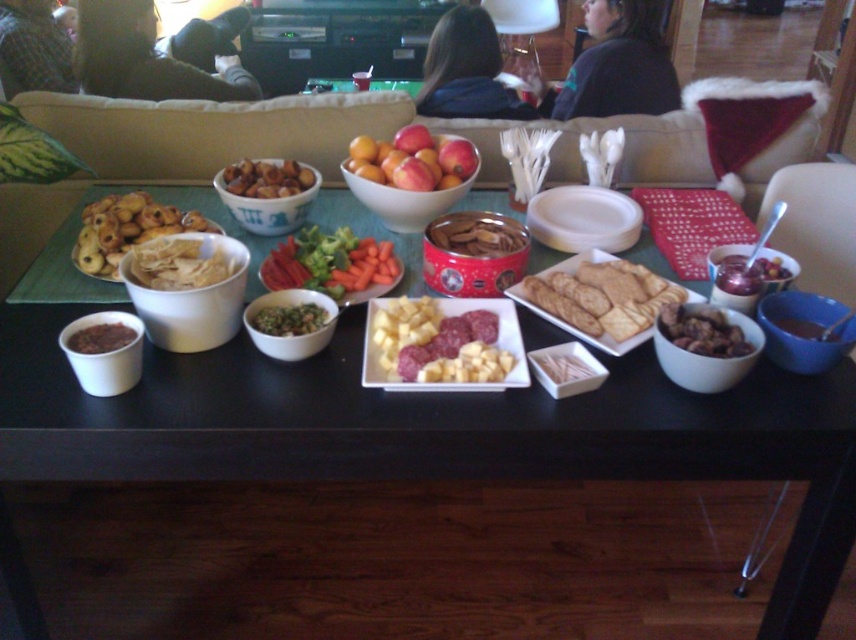
You are standing in the living room and want to reach both the point at coordinates point (x=349, y=234) and point (x=100, y=353). Which point is closer to you?

Point (x=349, y=234) is closer to you because it is further to the viewer than point (x=100, y=353).

You are standing at the table and want to reach both the point at coordinates (198, 275) and the point at coordinates (104, 349). Which point will you reach first?

You will reach the point at coordinates (198, 275) first because it is closer to you than the point at coordinates (104, 349).